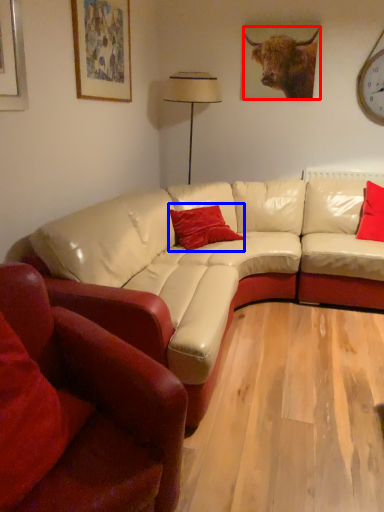
Question: Which point is further to the camera, bull (highlighted by a red box) or pillow (highlighted by a blue box)?

Choices:
 (A) bull
 (B) pillow

Answer: (A)